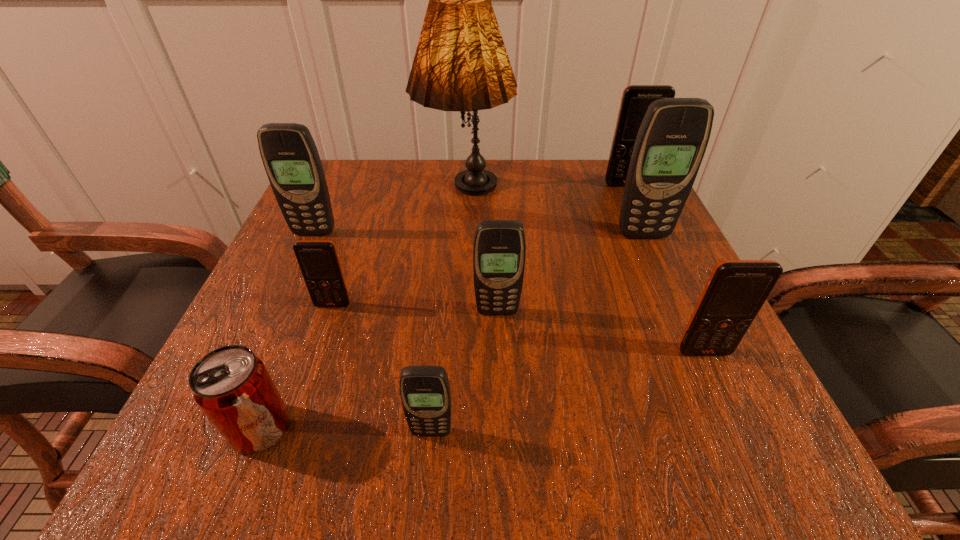
Where is `free space between the eighth shortest object and the pop soda`? The width and height of the screenshot is (960, 540). free space between the eighth shortest object and the pop soda is located at coordinates (451, 332).

This screenshot has height=540, width=960. I want to click on free space between the biggest orange cellular telephone and the nearest cellular telephone, so click(529, 308).

I want to click on free space between the red pop soda and the smallest gray cellular telephone, so click(x=346, y=430).

Locate an element on the screen. This screenshot has height=540, width=960. unoccupied area between the second gray cellular telephone from left to right and the leftmost gray cellular telephone is located at coordinates (372, 332).

Where is `free point between the second smallest orange cellular telephone and the pop soda`? free point between the second smallest orange cellular telephone and the pop soda is located at coordinates (482, 390).

Where is `vacant area that lies between the smallest gray cellular telephone and the third smallest gray cellular telephone`? Image resolution: width=960 pixels, height=540 pixels. vacant area that lies between the smallest gray cellular telephone and the third smallest gray cellular telephone is located at coordinates (372, 332).

Where is `empty location between the third biggest gray cellular telephone and the smallest orange cellular telephone`? The width and height of the screenshot is (960, 540). empty location between the third biggest gray cellular telephone and the smallest orange cellular telephone is located at coordinates (415, 308).

Image resolution: width=960 pixels, height=540 pixels. What are the coordinates of `the seventh closest object relative to the nearest cellular telephone` in the screenshot? It's located at 671,142.

Identify which object is the closest to the farthest orange cellular telephone. Please provide its 2D coordinates. Your answer should be formatted as a tuple, i.e. [(x, y)], where the tuple contains the x and y coordinates of a point satisfying the conditions above.

[(671, 142)]

You are a GUI agent. You are given a task and a screenshot of the screen. Output one action in this format:
    pyautogui.click(x=<x>, y=<y>)
    Task: Click on the cellular telephone that is the sixth nearest to the sixth farthest cellular telephone
    
    Given the screenshot: What is the action you would take?
    pyautogui.click(x=289, y=154)